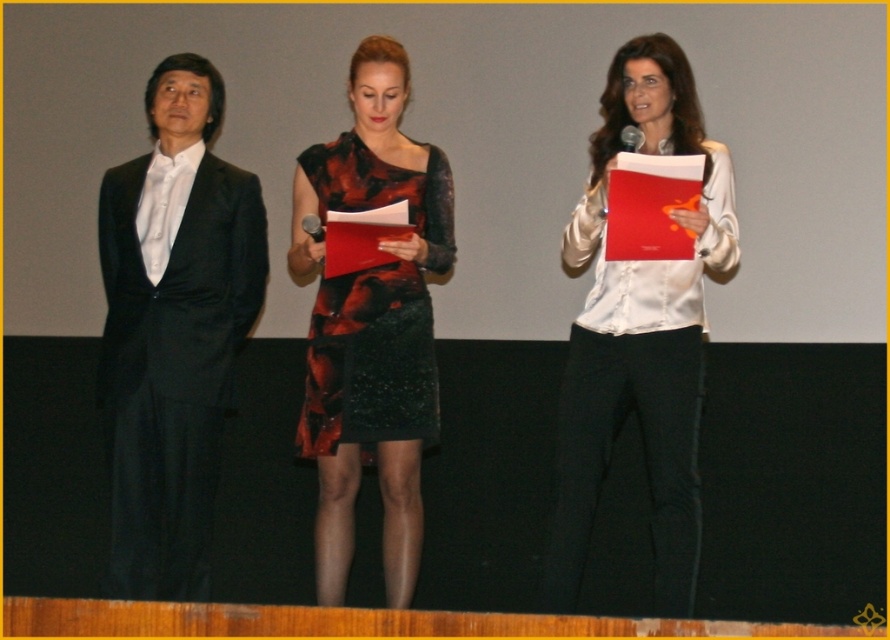
You are a photographer positioned behind the stage. You need to capture a clear photo of both the white satin blouse at center and the matte black suit at left. However, the lighting is currently only illuminating the front area. Which subject might be more visible in your photo?

The white satin blouse at center is in front of the matte black suit at left, so it will likely be more visible in the photo since it is closer to the light source.

You are a photographer at a formal event. You need to capture a closeup shot of the white satin blouse at center and the black textured dress at center. Which one should you focus on first if you want to ensure both are in focus without moving the camera?

The white satin blouse at center is positioned on the right side of black textured dress at center. Since they are side by side, you can focus on the black textured dress at center first as it is closer to the left, then adjust slightly to include the white satin blouse at center in the frame without moving the camera.

You are a photographer positioned behind the stage. You need to capture a photo of both the black textured dress at center and the matte black suit at left in the same frame. The camera you are using has a minimum focus distance of 12 inches. Will you be able to focus on both subjects simultaneously?

The distance between the black textured dress at center and the matte black suit at left is 14.13 inches, which is greater than the camera minimum focus distance of 12 inches. Therefore, the camera can focus on both subjects simultaneously.